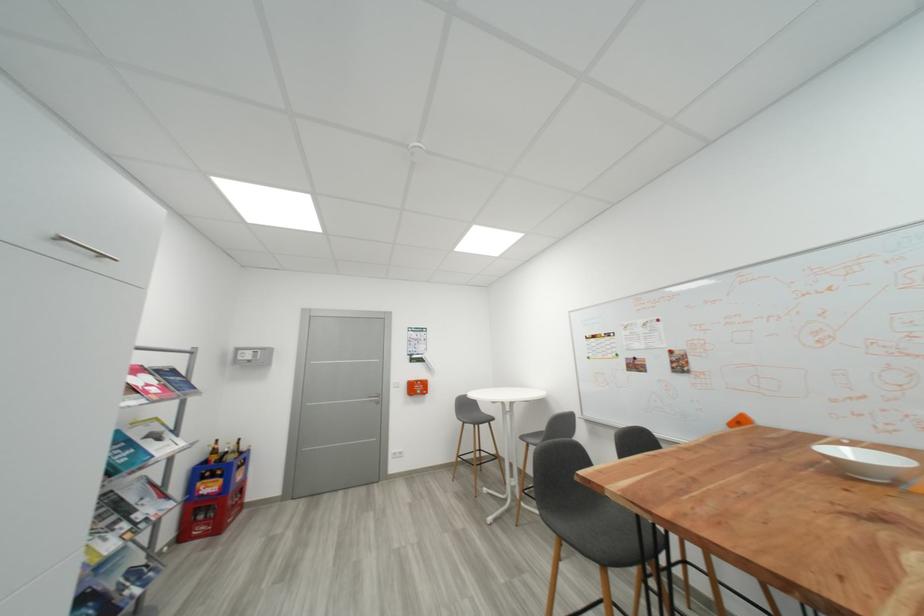
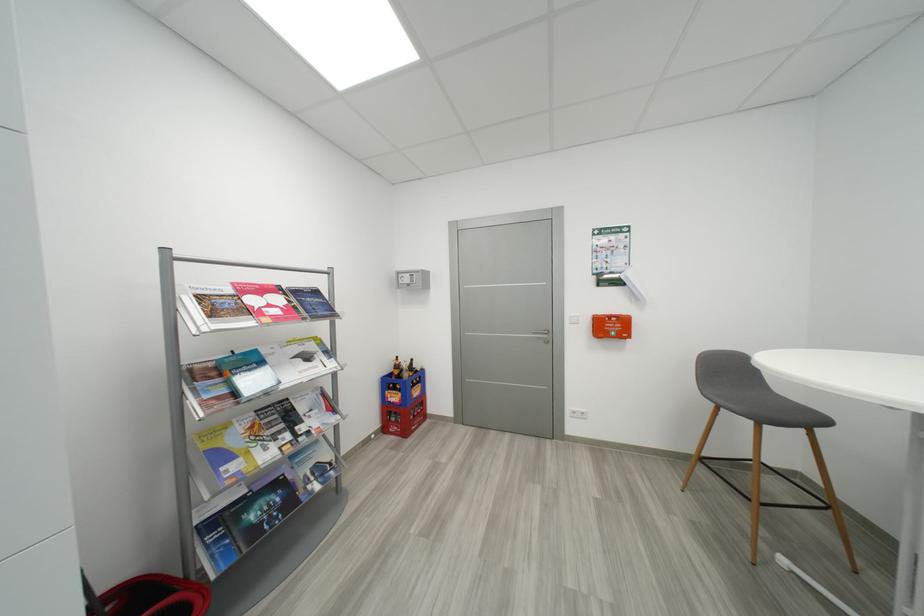
In the second image, find the point that corresponds to point 383,405 in the first image.

(553, 344)